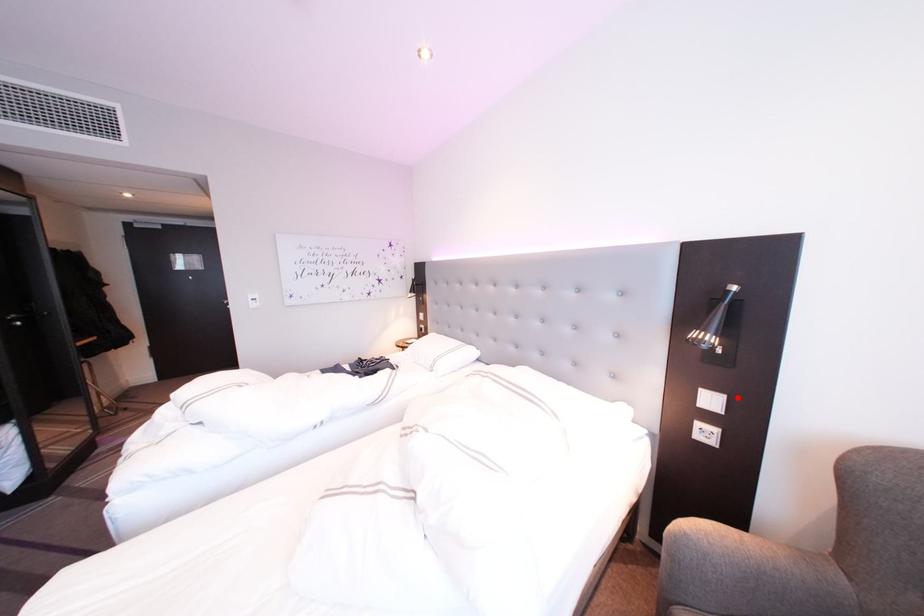
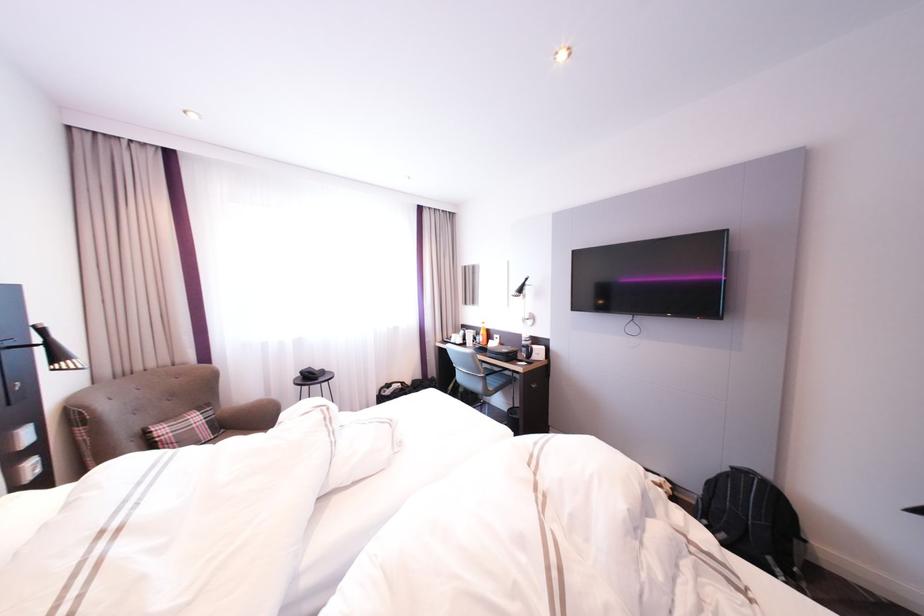
Locate, in the second image, the point that corresponds to the highlighted location in the first image.

(43, 424)